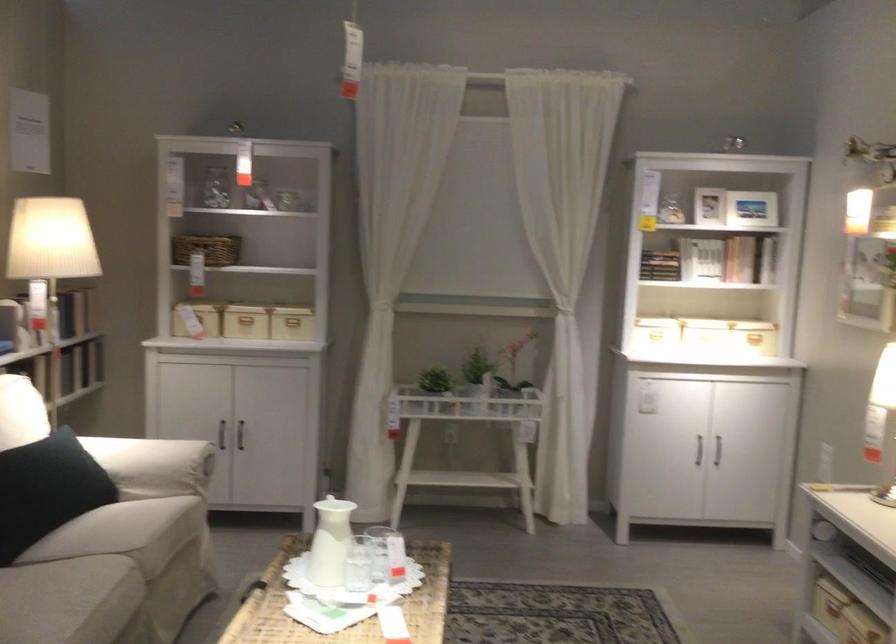
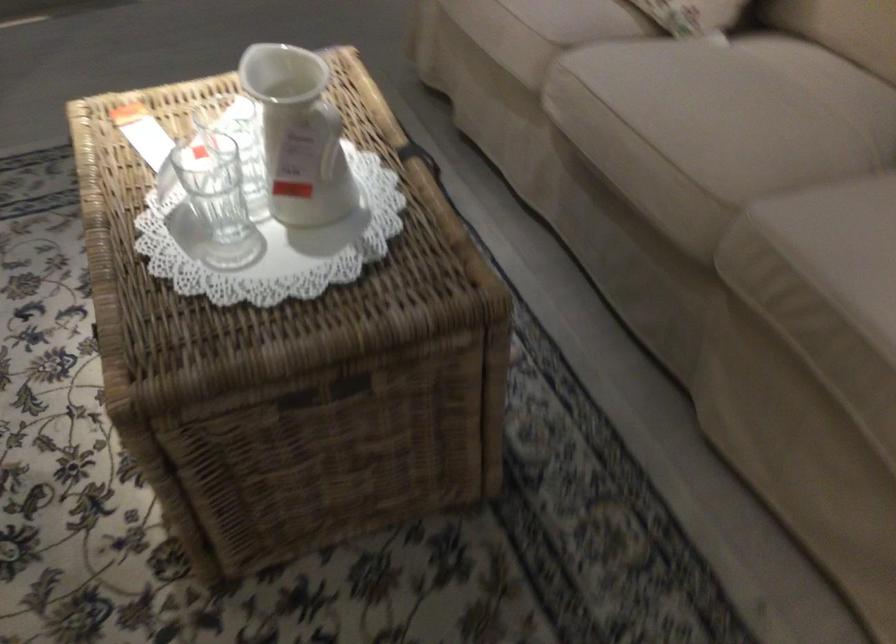
The point at (324, 534) is marked in the first image. Where is the corresponding point in the second image?

(328, 137)